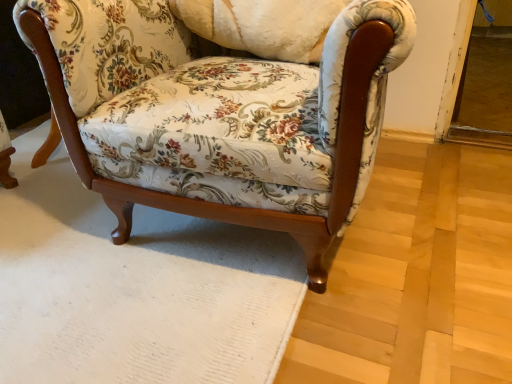
Question: Would you say floral fabric chair at center is to the left or to the right of floral fabric pillow at center in the picture?

Choices:
 (A) right
 (B) left

Answer: (A)

Question: Considering their positions, is floral fabric chair at center located in front of or behind floral fabric pillow at center?

Choices:
 (A) behind
 (B) front

Answer: (B)

Question: From a real-world perspective, relative to floral fabric pillow at center, is floral fabric chair at center vertically above or below?

Choices:
 (A) above
 (B) below

Answer: (B)

Question: Is floral fabric pillow at center bigger or smaller than floral fabric chair at center?

Choices:
 (A) big
 (B) small

Answer: (B)

Question: From the image's perspective, is floral fabric pillow at center above or below floral fabric chair at center?

Choices:
 (A) below
 (B) above

Answer: (B)

Question: In the image, is floral fabric pillow at center on the left side or the right side of floral fabric chair at center?

Choices:
 (A) right
 (B) left

Answer: (B)

Question: Is floral fabric pillow at center inside or outside of floral fabric chair at center?

Choices:
 (A) outside
 (B) inside

Answer: (B)